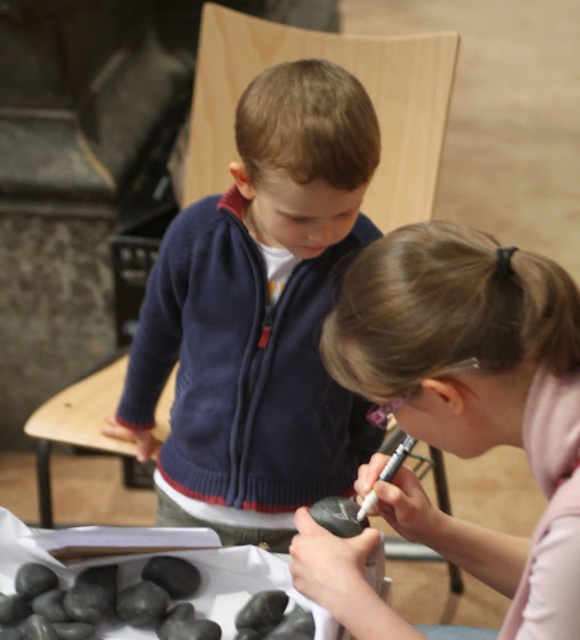
Question: Which point is farther from the camera taking this photo?

Choices:
 (A) (150, 436)
 (B) (440, 356)

Answer: (A)

Question: Which object appears farthest from the camera in this image?

Choices:
 (A) navy fleece sweater at center
 (B) smooth black rock at center

Answer: (A)

Question: Is navy fleece sweater at center closer to camera compared to smooth black rock at center?

Choices:
 (A) no
 (B) yes

Answer: (A)

Question: Is navy fleece sweater at center thinner than smooth black rock at center?

Choices:
 (A) yes
 (B) no

Answer: (B)

Question: Does navy fleece sweater at center appear over smooth black rock at center?

Choices:
 (A) yes
 (B) no

Answer: (A)